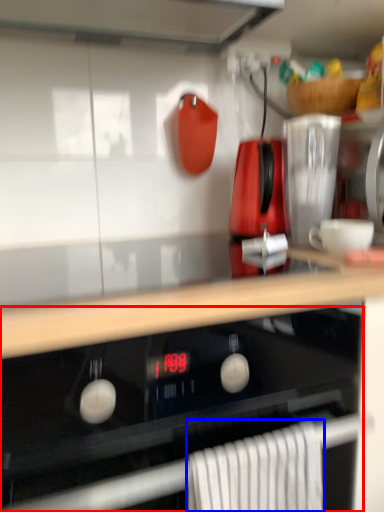
Question: Which point is further to the camera, oven (highlighted by a red box) or bath towel (highlighted by a blue box)?

Choices:
 (A) oven
 (B) bath towel

Answer: (B)